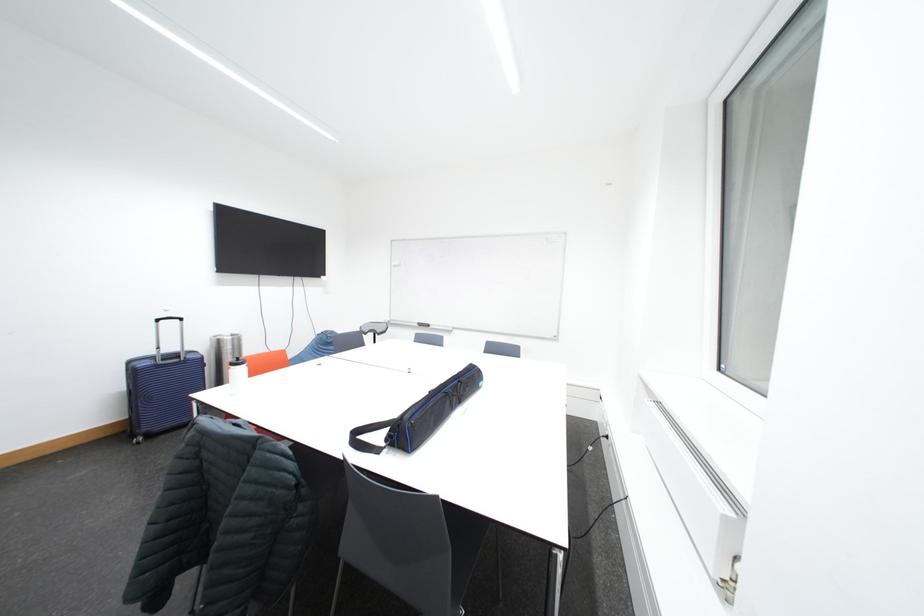
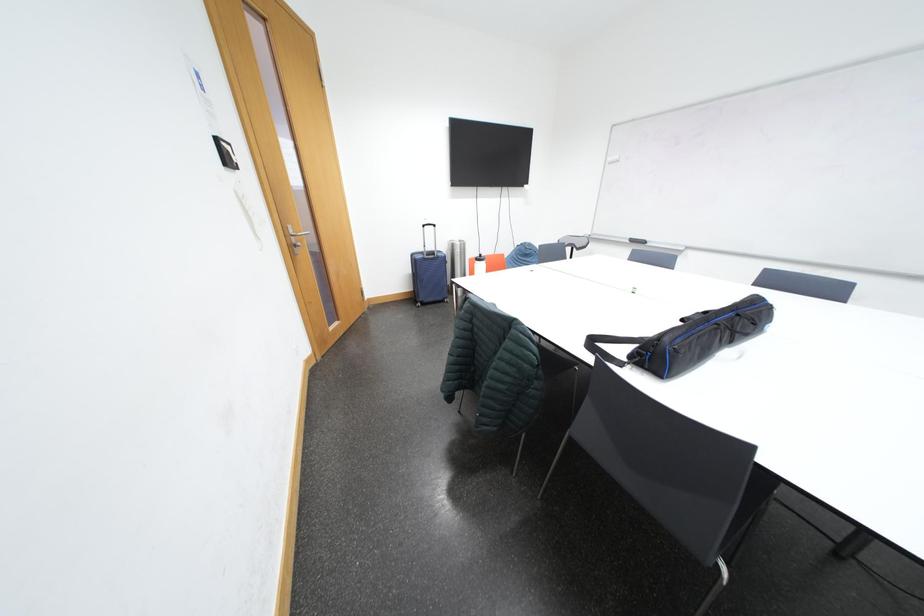
The first image is from the beginning of the video and the second image is from the end. How did the camera likely rotate when shooting the video?

The camera's rotation is toward left-down.